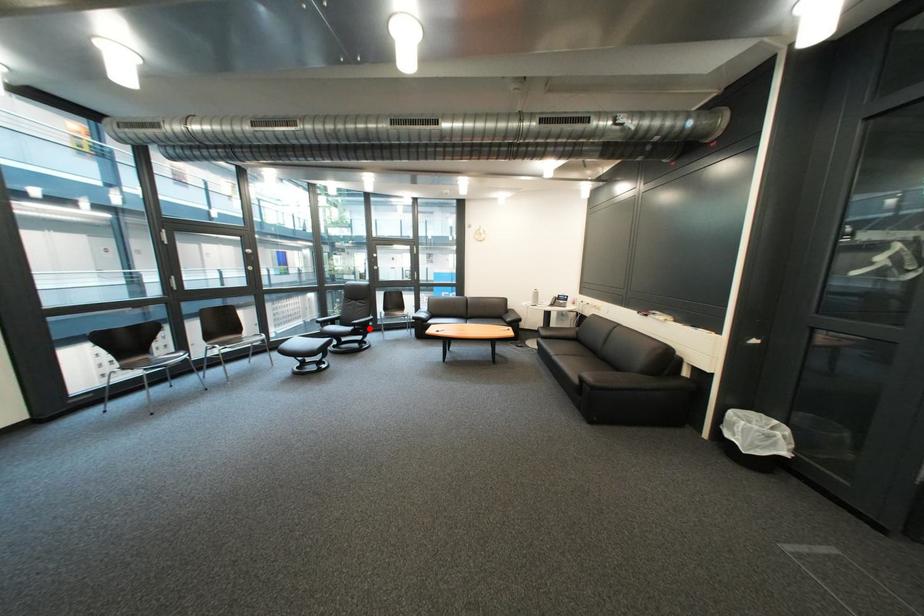
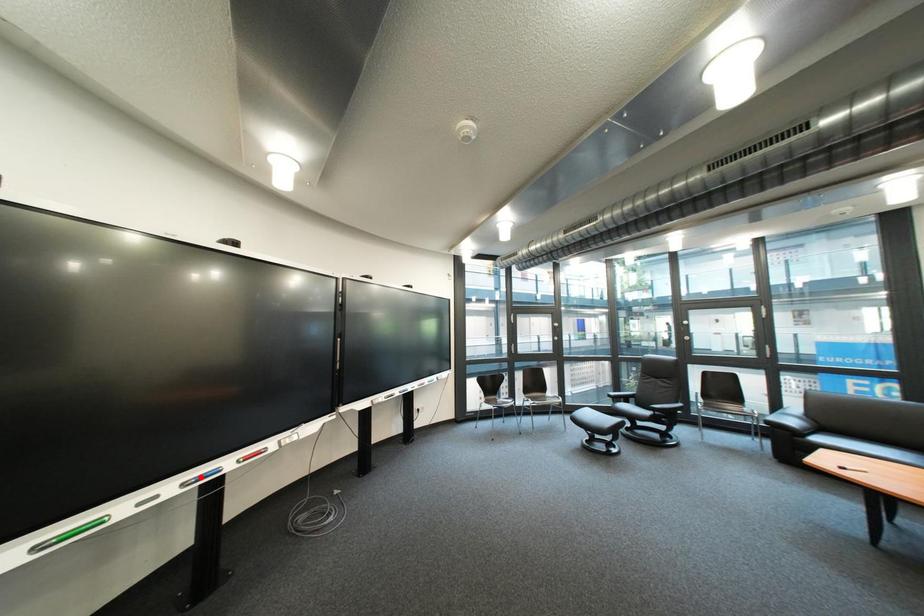
I am providing you with two images of the same scene from different viewpoints. A red point is marked on the first image and another point is marked on the second image. Are the points marked in image1 and image2 representing the same 3D position?

No